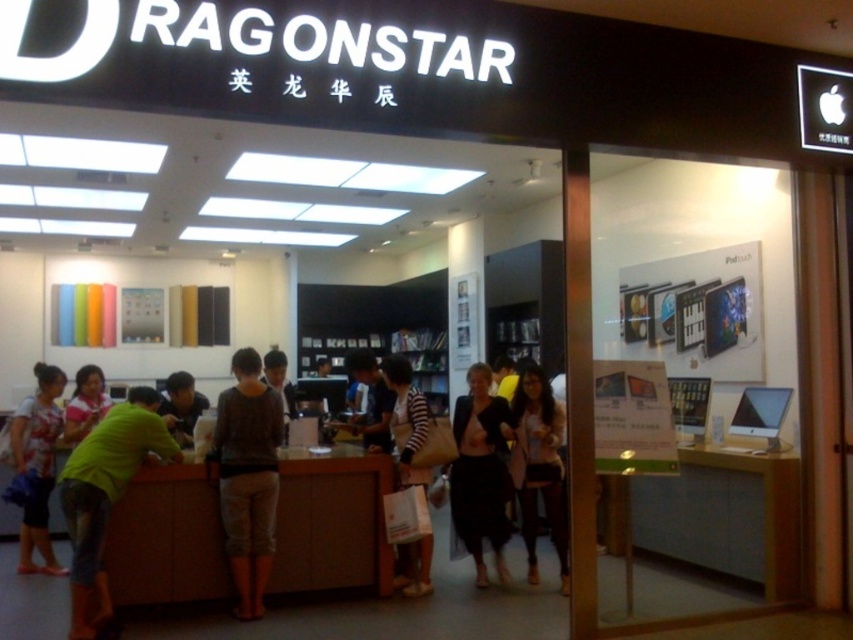
Who is more distant from viewer, (688,474) or (258,440)?

Positioned behind is point (688,474).

Between white glossy monitor at right and dark gray cotton pants at center, which one appears on the right side from the viewer's perspective?

white glossy monitor at right is more to the right.

Measure the distance between white glossy monitor at right and camera.

They are 4.56 meters apart.

Where is `white glossy monitor at right`? This screenshot has height=640, width=853. white glossy monitor at right is located at coordinates (717, 515).

Does green matte shirt at left have a smaller size compared to black sheer skirt at center?

Actually, green matte shirt at left might be larger than black sheer skirt at center.

Is green matte shirt at left positioned at the back of black sheer skirt at center?

That is False.

Which is behind, point (94, 572) or point (471, 401)?

The point (471, 401) is behind.

Where is `green matte shirt at left`? green matte shirt at left is located at coordinates (105, 496).

Measure the distance between brown wood desk at center and printed cotton shirt at lower left.

They are 2.22 meters apart.

Does brown wood desk at center appear over printed cotton shirt at lower left?

No, brown wood desk at center is not above printed cotton shirt at lower left.

Who is more distant from viewer, [120,500] or [26,440]?

The point [26,440] is behind.

Where is `brown wood desk at center`? brown wood desk at center is located at coordinates pyautogui.click(x=331, y=522).